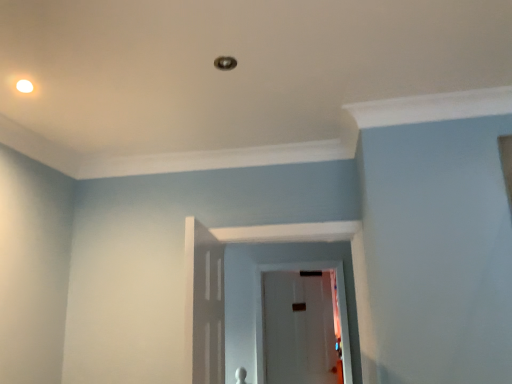
Measure the distance between white glossy light fixture at upper left and camera.

white glossy light fixture at upper left is 1.66 meters away from camera.

Find the location of `white glossy light fixture at upper left`. white glossy light fixture at upper left is located at coordinates (24, 86).

What do you see at coordinates (24, 86) in the screenshot?
I see `white glossy light fixture at upper left` at bounding box center [24, 86].

The width and height of the screenshot is (512, 384). What do you see at coordinates (261, 311) in the screenshot?
I see `transparent glass door at center` at bounding box center [261, 311].

Locate an element on the screen. transparent glass door at center is located at coordinates (261, 311).

What is the approximate width of transparent glass door at center?

It is 5.10 centimeters.

Where is `white glossy light fixture at upper left`? This screenshot has height=384, width=512. white glossy light fixture at upper left is located at coordinates (24, 86).

Is transparent glass door at center at the left side of white glossy light fixture at upper left?

No, transparent glass door at center is not to the left of white glossy light fixture at upper left.

Is transparent glass door at center closer to camera compared to white glossy light fixture at upper left?

No, it is not.

Does point (313, 263) come closer to viewer compared to point (25, 79)?

No, (313, 263) is further to viewer.

From the image's perspective, between transparent glass door at center and white glossy light fixture at upper left, which one is located above?

white glossy light fixture at upper left is shown above in the image.

From a real-world perspective, between transparent glass door at center and white glossy light fixture at upper left, who is vertically higher?

white glossy light fixture at upper left is physically above.

Looking at their sizes, would you say transparent glass door at center is wider or thinner than white glossy light fixture at upper left?

Considering their sizes, transparent glass door at center looks slimmer than white glossy light fixture at upper left.

Who is shorter, transparent glass door at center or white glossy light fixture at upper left?

Standing shorter between the two is white glossy light fixture at upper left.

Can you confirm if transparent glass door at center is bigger than white glossy light fixture at upper left?

Yes.

Does transparent glass door at center contain white glossy light fixture at upper left?

No, white glossy light fixture at upper left is located outside of transparent glass door at center.

Is transparent glass door at center with white glossy light fixture at upper left?

No, transparent glass door at center is not in contact with white glossy light fixture at upper left.

Is transparent glass door at center looking in the opposite direction of white glossy light fixture at upper left?

transparent glass door at center does not have its back to white glossy light fixture at upper left.

How different are the orientations of transparent glass door at center and white glossy light fixture at upper left in degrees?

The angular difference between transparent glass door at center and white glossy light fixture at upper left is 61.2 degrees.

Find the location of a particular element. This screenshot has height=384, width=512. glass door directly beneath the white glossy light fixture at upper left (from a real-world perspective) is located at coordinates (261, 311).

Does white glossy light fixture at upper left appear on the right side of transparent glass door at center?

In fact, white glossy light fixture at upper left is to the left of transparent glass door at center.

Which object is more forward, white glossy light fixture at upper left or transparent glass door at center?

white glossy light fixture at upper left is more forward.

Which is more distant, (x=31, y=84) or (x=254, y=341)?

The point (x=254, y=341) is behind.

From the image's perspective, is white glossy light fixture at upper left located above or below transparent glass door at center?

white glossy light fixture at upper left is above transparent glass door at center.

From a real-world perspective, which object rests below the other?

From a 3D spatial view, transparent glass door at center is below.

Is white glossy light fixture at upper left wider or thinner than transparent glass door at center?

Clearly, white glossy light fixture at upper left has more width compared to transparent glass door at center.

Is white glossy light fixture at upper left shorter than transparent glass door at center?

Correct, white glossy light fixture at upper left is not as tall as transparent glass door at center.

In terms of size, does white glossy light fixture at upper left appear bigger or smaller than transparent glass door at center?

In the image, white glossy light fixture at upper left appears to be smaller than transparent glass door at center.

Would you say white glossy light fixture at upper left is outside transparent glass door at center?

white glossy light fixture at upper left is positioned outside transparent glass door at center.

Is white glossy light fixture at upper left next to transparent glass door at center and touching it?

Answer: No, white glossy light fixture at upper left is not making contact with transparent glass door at center.

Is white glossy light fixture at upper left positioned with its back to transparent glass door at center?

No, white glossy light fixture at upper left is not facing away from transparent glass door at center.

Looking at this image, what's the angular difference between white glossy light fixture at upper left and transparent glass door at center's facing directions?

There is a 61.2-degree angle between the facing directions of white glossy light fixture at upper left and transparent glass door at center.

Find the location of a particular element. The width and height of the screenshot is (512, 384). lighting above the transparent glass door at center (from the image's perspective) is located at coordinates (24, 86).

Where is `lighting located above the transparent glass door at center (from the image's perspective)`? lighting located above the transparent glass door at center (from the image's perspective) is located at coordinates (24, 86).

Where is `lighting on the left of transparent glass door at center`? The image size is (512, 384). lighting on the left of transparent glass door at center is located at coordinates (24, 86).